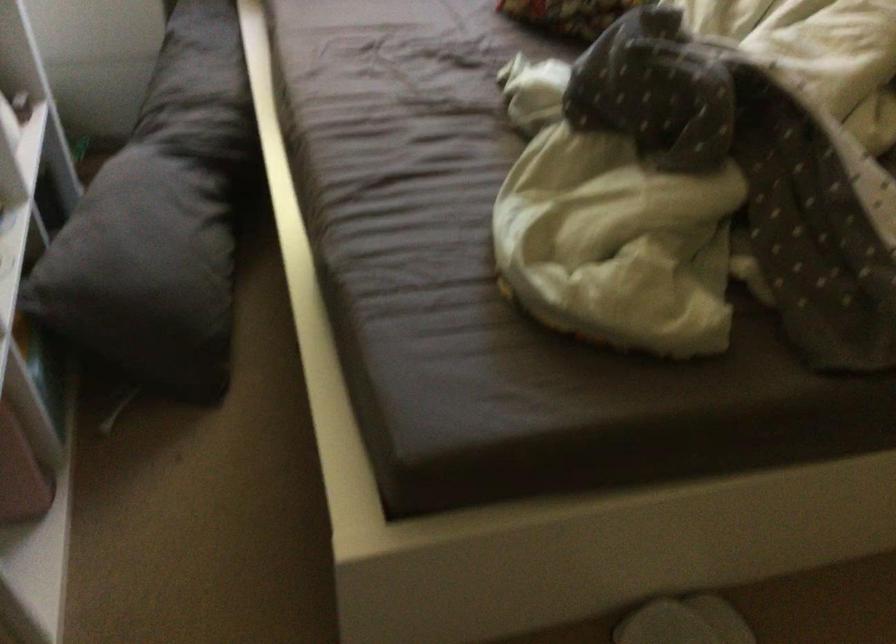
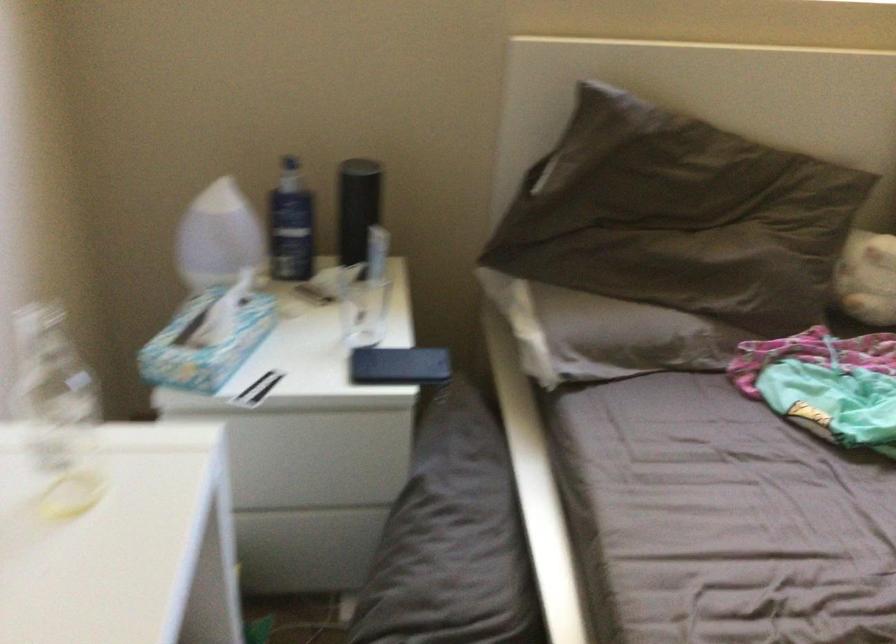
Question: How did the camera likely rotate?

Choices:
 (A) Left
 (B) Right
 (C) Up
 (D) Down

Answer: (C)